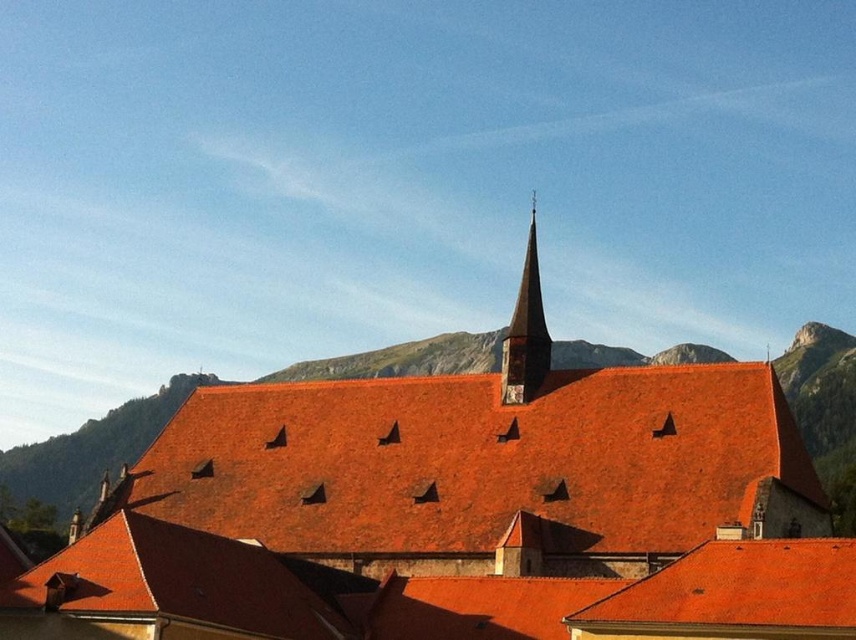
You are a window cleaner standing at the base of the building. You need to clean both the matte orange roof at center and the shiny orange tiles at center. Given that your ladder can extend up to 6 feet, can you reach both areas without moving the ladder?

The matte orange roof at center and shiny orange tiles at center are 6.76 feet apart. Since your ladder only extends to 6 feet, you cannot reach both areas without moving the ladder because the distance between them exceeds the ladder length.

You are an architect examining the building and notice the shiny orange tiles at center and the smooth stone spire at upper center. Which object is closer to the observer when looking at the building from the front?

The shiny orange tiles at center are closer to the observer because they are positioned in front of the smooth stone spire at upper center.